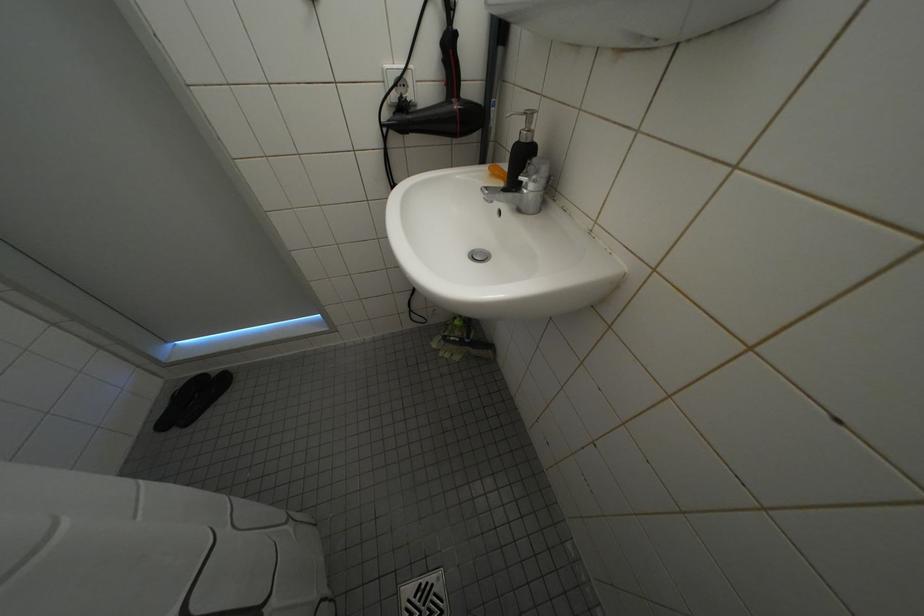
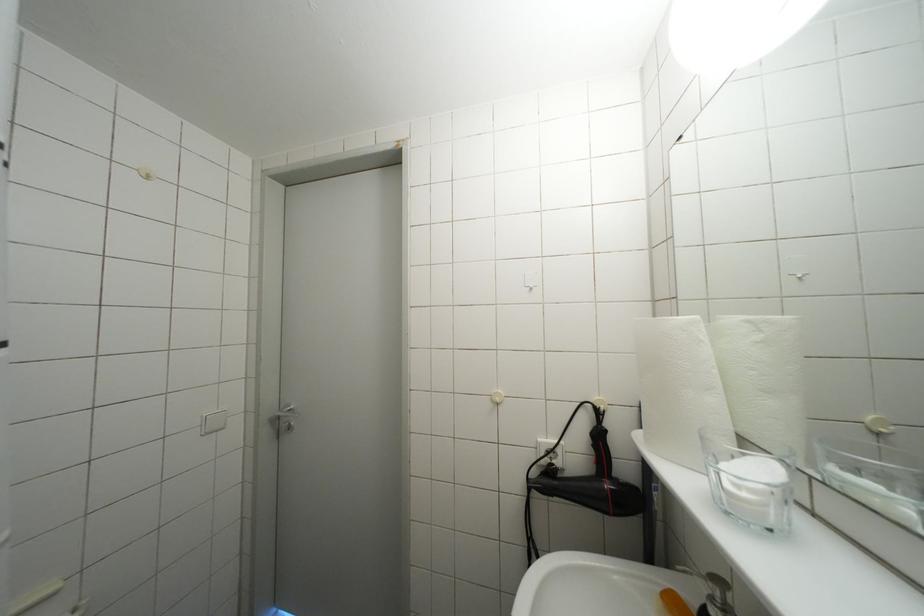
How did the camera likely rotate?

The rotation direction of the camera is left-up.